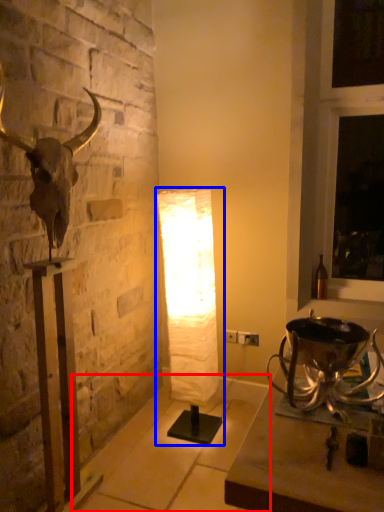
Question: Which of the following is the closest to the observer, concrete (highlighted by a red box) or lamp (highlighted by a blue box)?

Choices:
 (A) concrete
 (B) lamp

Answer: (A)